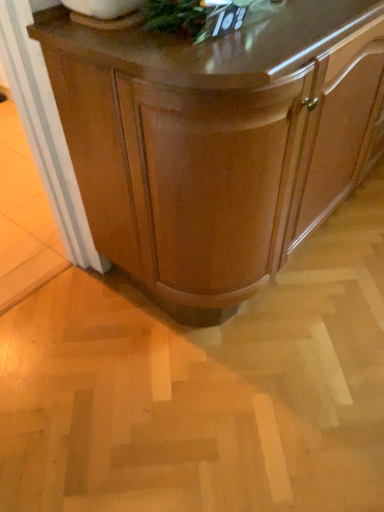
Measure the distance between point (x=59, y=47) and camera.

The depth of point (x=59, y=47) is 38.07 inches.

Describe the element at coordinates (216, 143) in the screenshot. I see `glossy wood cabinet at center` at that location.

The image size is (384, 512). Find the location of `glossy wood cabinet at center`. glossy wood cabinet at center is located at coordinates point(216,143).

The width and height of the screenshot is (384, 512). In order to click on glossy wood cabinet at center in this screenshot , I will do `click(216, 143)`.